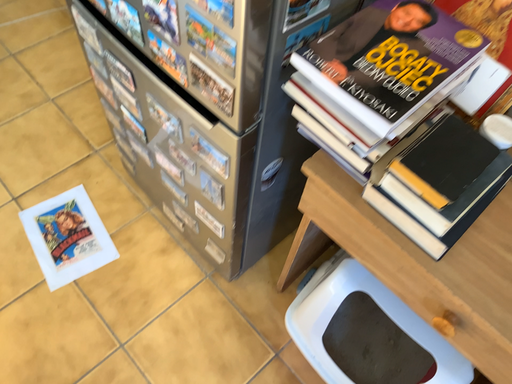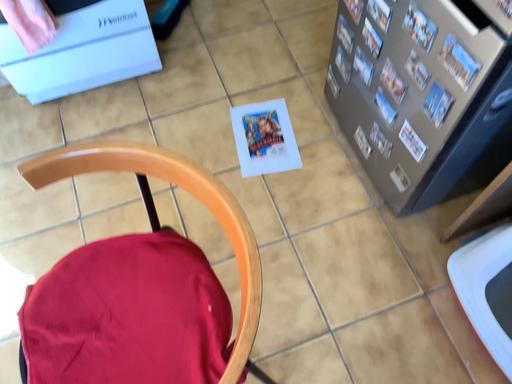
Question: How did the camera likely rotate when shooting the video?

Choices:
 (A) rotated left
 (B) rotated right

Answer: (A)